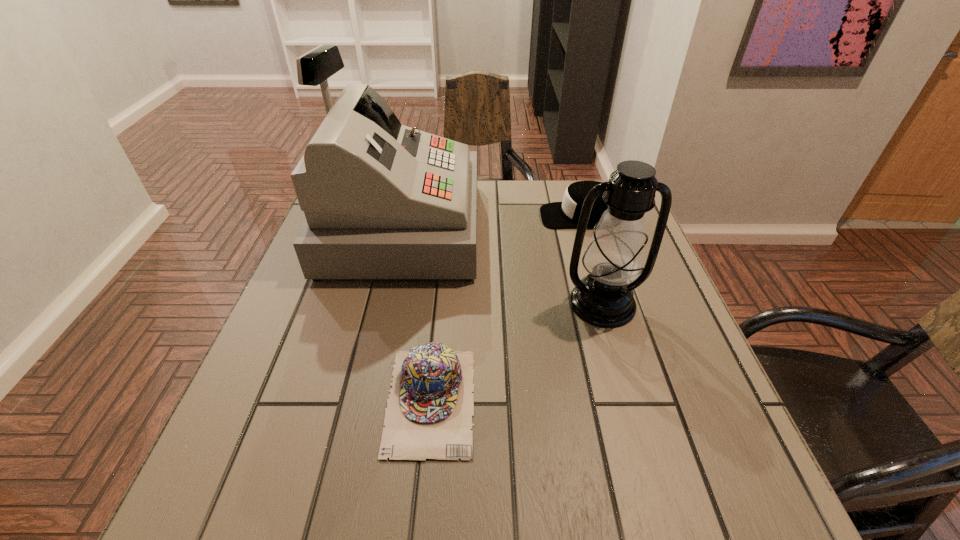
Find the location of a particular element. vacant space located 0.400m on the front-facing side of the third tallest object is located at coordinates (396, 216).

Identify the location of vacant space located 0.080m on the front, side, and top of the nearest object. This screenshot has width=960, height=540. (420, 515).

Locate an element on the screen. The image size is (960, 540). cash register that is at the far edge is located at coordinates (382, 200).

Where is `cap that is at the far edge`? The width and height of the screenshot is (960, 540). cap that is at the far edge is located at coordinates (554, 215).

Identify the location of object positioned at the left edge. (382, 200).

The width and height of the screenshot is (960, 540). I want to click on oil lamp positioned at the right edge, so click(x=614, y=257).

You are a GUI agent. You are given a task and a screenshot of the screen. Output one action in this format:
    pyautogui.click(x=<x>, y=<y>)
    Task: Click on the cap present at the right edge
    
    Given the screenshot: What is the action you would take?
    pyautogui.click(x=554, y=215)

Locate an element on the screen. This screenshot has width=960, height=540. object that is at the far left corner is located at coordinates (382, 200).

At what (x,y) coordinates should I click in order to perform the action: click on object that is at the far right corner. Please return your answer as a coordinate pair (x, y). Image resolution: width=960 pixels, height=540 pixels. Looking at the image, I should click on click(554, 215).

Find the location of `vacant space at the near edge of the desktop`. vacant space at the near edge of the desktop is located at coordinates (422, 514).